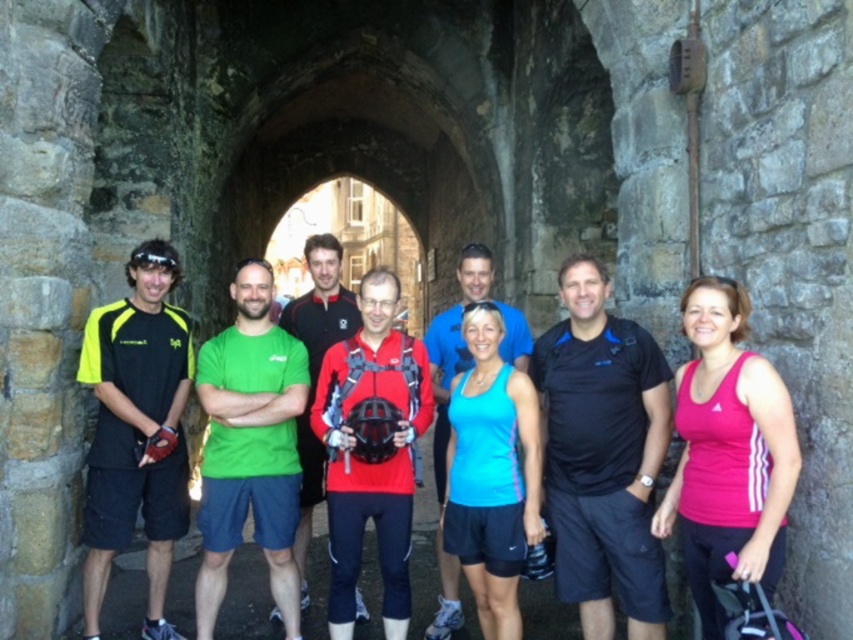
Can you confirm if black fabric shirt at center is bigger than red matte helmet at center?

No, black fabric shirt at center is not bigger than red matte helmet at center.

What do you see at coordinates (602, 454) in the screenshot? The height and width of the screenshot is (640, 853). I see `black fabric shirt at center` at bounding box center [602, 454].

The height and width of the screenshot is (640, 853). Identify the location of black fabric shirt at center. (602, 454).

In order to click on red matte helmet at center in this screenshot , I will do `click(320, 304)`.

Looking at this image, between red matte helmet at center and blue fabric shirt at center, which one appears on the right side from the viewer's perspective?

Positioned to the right is blue fabric shirt at center.

Describe the element at coordinates (320, 304) in the screenshot. I see `red matte helmet at center` at that location.

This screenshot has height=640, width=853. Identify the location of red matte helmet at center. (320, 304).

Can you confirm if pink fabric tank top at right is shorter than blue fabric shirt at center?

Indeed, pink fabric tank top at right has a lesser height compared to blue fabric shirt at center.

Which is behind, point (693, 467) or point (433, 317)?

The point (433, 317) is behind.

Does point (775, 486) come in front of point (438, 401)?

Yes, it is.

Find the location of a particular element. The width and height of the screenshot is (853, 640). pink fabric tank top at right is located at coordinates (728, 452).